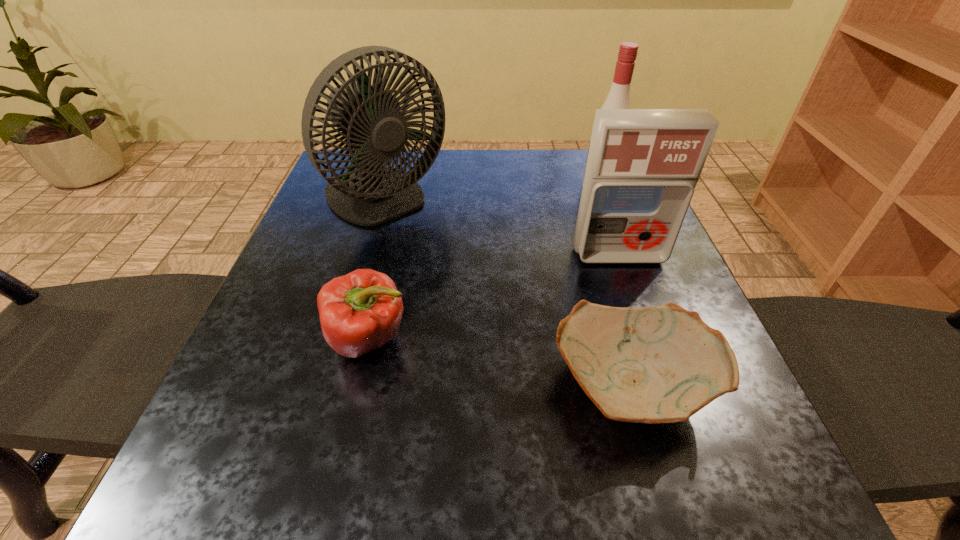
At what (x,y) coordinates should I click in order to perform the action: click on vacant point located between the pottery and the fan. Please return your answer as a coordinate pair (x, y). The width and height of the screenshot is (960, 540). Looking at the image, I should click on (508, 294).

At what (x,y) coordinates should I click in order to perform the action: click on empty space between the shortest object and the fourth tallest object. Please return your answer as a coordinate pair (x, y). The image size is (960, 540). Looking at the image, I should click on (500, 362).

Where is `free space between the alcohol and the fan`? The height and width of the screenshot is (540, 960). free space between the alcohol and the fan is located at coordinates (492, 195).

You are a GUI agent. You are given a task and a screenshot of the screen. Output one action in this format:
    pyautogui.click(x=<x>, y=<y>)
    Task: Click on the unoccupied position between the pottery and the fourth tallest object
    
    Given the screenshot: What is the action you would take?
    pyautogui.click(x=500, y=362)

Find the location of a particular element. This screenshot has height=540, width=960. the closest object to the fan is located at coordinates (361, 311).

Select which object appears as the closest to the alcohol. Please provide its 2D coordinates. Your answer should be formatted as a tuple, i.e. [(x, y)], where the tuple contains the x and y coordinates of a point satisfying the conditions above.

[(643, 165)]

At what (x,y) coordinates should I click in order to perform the action: click on vacant area that satisfies the following two spatial constraints: 1. in front of the pottery to direct airflow; 2. on the right side of the fan. Please return your answer as a coordinate pair (x, y). This screenshot has width=960, height=540. Looking at the image, I should click on (333, 386).

Where is `vacant space that satisfies the following two spatial constraints: 1. in front of the fan to direct airflow; 2. on the right side of the shortest object`? The image size is (960, 540). vacant space that satisfies the following two spatial constraints: 1. in front of the fan to direct airflow; 2. on the right side of the shortest object is located at coordinates (333, 386).

Image resolution: width=960 pixels, height=540 pixels. I want to click on blank area in the image that satisfies the following two spatial constraints: 1. in front of the second shortest object to direct airflow; 2. on the left side of the fan, so click(347, 338).

This screenshot has height=540, width=960. I want to click on free spot that satisfies the following two spatial constraints: 1. on the front side of the shortest object; 2. on the right side of the bell pepper, so click(358, 386).